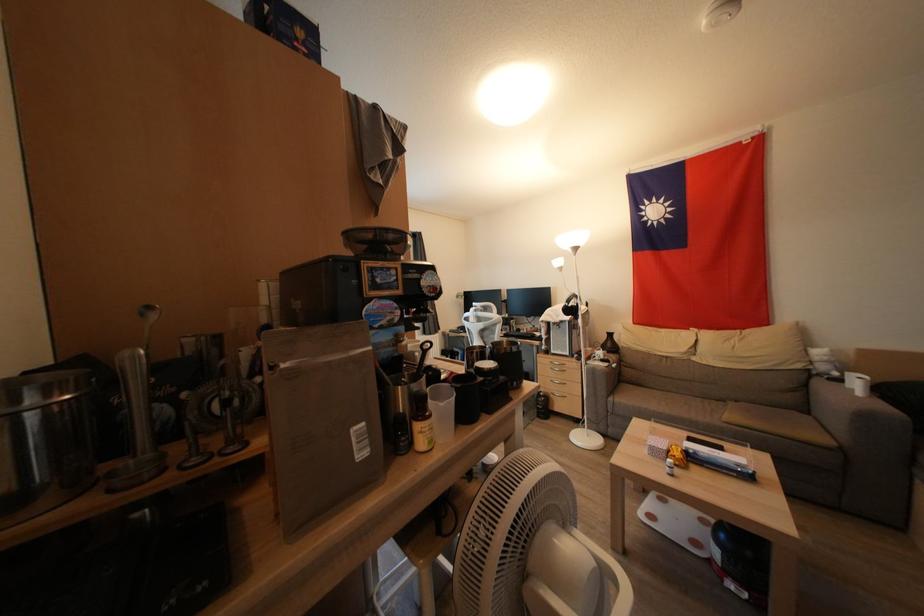
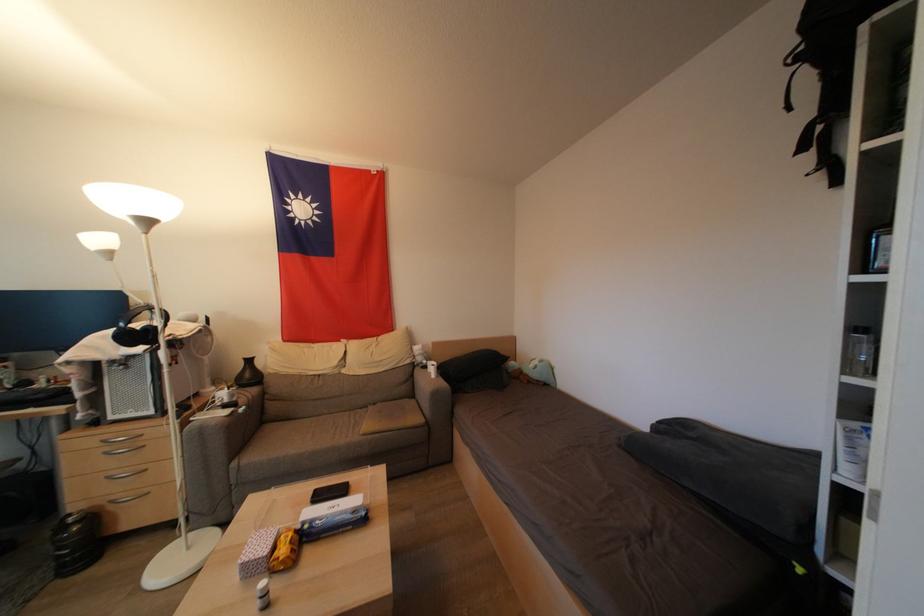
Locate, in the second image, the point that corresponds to point 563,265 in the first image.

(104, 244)